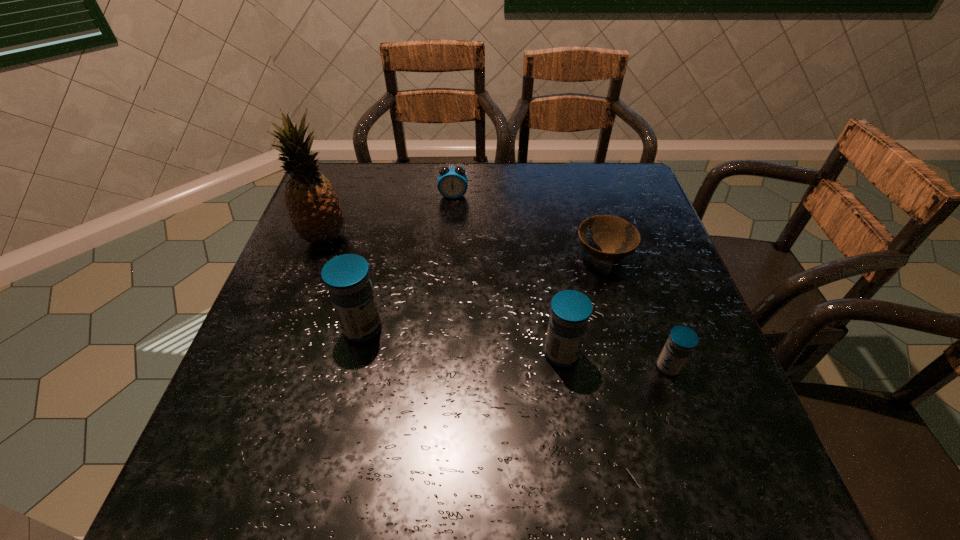
Please determine a free point for an extra medicine to ensure balance. Please provide its 2D coordinates. Your answer should be formatted as a tuple, i.e. [(x, y)], where the tuple contains the x and y coordinates of a point satisfying the conditions above.

[(460, 340)]